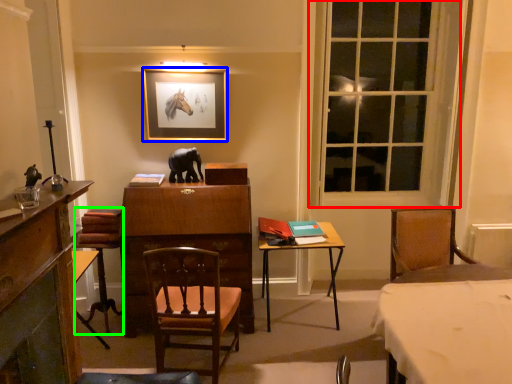
Question: Estimate the real-world distances between objects in this image. Which object is closer to window (highlighted by a red box), picture frame (highlighted by a blue box) or swivel chair (highlighted by a green box)?

Choices:
 (A) picture frame
 (B) swivel chair

Answer: (A)